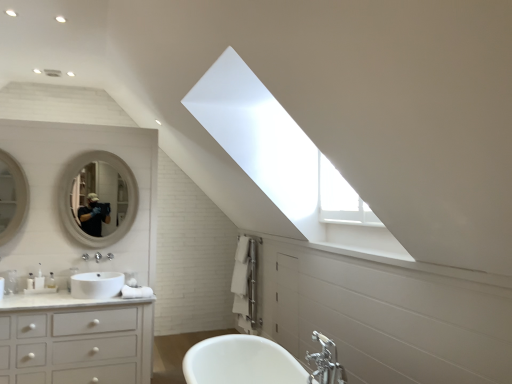
Locate an element on the screen. white glossy mirror at upper left, acting as the 1th mirror starting from the back is located at coordinates (99, 198).

Describe the element at coordinates (12, 197) in the screenshot. This screenshot has height=384, width=512. I see `matte white mirror at left, which is the second mirror from right to left` at that location.

What do you see at coordinates (241, 362) in the screenshot? I see `white glossy bathtub at center` at bounding box center [241, 362].

The height and width of the screenshot is (384, 512). Describe the element at coordinates (75, 340) in the screenshot. I see `white matte cabinet at lower left` at that location.

This screenshot has height=384, width=512. Find the location of `white glossy sink at lower left`. white glossy sink at lower left is located at coordinates (96, 285).

Is white glossy sink at lower left far away from white glossy bathtub at center?

white glossy sink at lower left is far away from white glossy bathtub at center.

Measure the distance between white glossy sink at lower left and white glossy bathtub at center.

A distance of 1.21 meters exists between white glossy sink at lower left and white glossy bathtub at center.

Considering the relative positions of white glossy sink at lower left and white glossy bathtub at center in the image provided, is white glossy sink at lower left to the left or to the right of white glossy bathtub at center?

white glossy sink at lower left is to the left of white glossy bathtub at center.

Based on the photo, is white glossy mirror at upper left, which ranks as the 2th mirror in front-to-back order, not near matte white mirror at left, the 1th mirror positioned from the front?

white glossy mirror at upper left, which ranks as the 2th mirror in front-to-back order, is actually quite close to matte white mirror at left, the 1th mirror positioned from the front.

Can you tell me how much white glossy mirror at upper left, the 1th mirror viewed from the right, and matte white mirror at left, which is the second mirror from right to left, differ in facing direction?

The angular difference between white glossy mirror at upper left, the 1th mirror viewed from the right, and matte white mirror at left, which is the second mirror from right to left, is 0.00102 degrees.

Do you think white glossy mirror at upper left, the 1th mirror viewed from the right, is within matte white mirror at left, which is the second mirror from right to left, or outside of it?

white glossy mirror at upper left, the 1th mirror viewed from the right, is not enclosed by matte white mirror at left, which is the second mirror from right to left.

From a real-world perspective, between white glossy mirror at upper left, the 1th mirror viewed from the right, and matte white mirror at left, acting as the first mirror starting from the left, who is vertically higher?

From a 3D spatial view, matte white mirror at left, acting as the first mirror starting from the left, is above.

From a real-world perspective, is matte white mirror at left, which is the second mirror from right to left, beneath white glossy mirror at upper left, acting as the 1th mirror starting from the back?

No.

Between matte white mirror at left, which is the 2th mirror from back to front, and white glossy mirror at upper left, the 2th mirror when ordered from left to right, which one has smaller size?

With smaller size is matte white mirror at left, which is the 2th mirror from back to front.

Considering the sizes of objects matte white mirror at left, which is the second mirror from right to left, and white glossy mirror at upper left, acting as the 1th mirror starting from the back, in the image provided, who is taller, matte white mirror at left, which is the second mirror from right to left, or white glossy mirror at upper left, acting as the 1th mirror starting from the back,?

white glossy mirror at upper left, acting as the 1th mirror starting from the back, is taller.

Locate an element on the screen. mirror behind the matte white mirror at left, acting as the first mirror starting from the left is located at coordinates (99, 198).

Considering the positions of point (252, 353) and point (119, 185), is point (252, 353) closer or farther from the camera than point (119, 185)?

Point (252, 353).

From the image's perspective, is white glossy bathtub at center below white glossy mirror at upper left, the 1th mirror viewed from the right?

Yes, from the image's perspective, white glossy bathtub at center is beneath white glossy mirror at upper left, the 1th mirror viewed from the right.

Which is more to the left, white glossy bathtub at center or white glossy mirror at upper left, which ranks as the 2th mirror in front-to-back order?

Positioned to the left is white glossy mirror at upper left, which ranks as the 2th mirror in front-to-back order.

Does white matte cabinet at lower left have a lesser width compared to white glossy bathtub at center?

Correct, the width of white matte cabinet at lower left is less than that of white glossy bathtub at center.

How many degrees apart are the facing directions of white matte cabinet at lower left and white glossy bathtub at center?

1.14 degrees.

Which is correct: white matte cabinet at lower left is inside white glossy bathtub at center, or outside of it?

white matte cabinet at lower left exists outside the volume of white glossy bathtub at center.

Which is in front, point (125, 334) or point (221, 346)?

The point (221, 346) is more forward.

You are a GUI agent. You are given a task and a screenshot of the screen. Output one action in this format:
    pyautogui.click(x=<x>, y=<y>)
    Task: Click on the bath on the right of matte white mirror at left, which is the second mirror from right to left
    
    Given the screenshot: What is the action you would take?
    pyautogui.click(x=241, y=362)

How much distance is there between matte white mirror at left, the 1th mirror positioned from the front, and white glossy bathtub at center?

matte white mirror at left, the 1th mirror positioned from the front, and white glossy bathtub at center are 2.15 meters apart.

Considering the relative sizes of matte white mirror at left, which is the second mirror from right to left, and white glossy bathtub at center in the image provided, is matte white mirror at left, which is the second mirror from right to left, thinner than white glossy bathtub at center?

Yes, matte white mirror at left, which is the second mirror from right to left, is thinner than white glossy bathtub at center.

From a real-world perspective, which is physically below, matte white mirror at left, which is the 2th mirror from back to front, or white glossy bathtub at center?

From a 3D spatial view, white glossy bathtub at center is below.

Is white glossy bathtub at center in front of white matte cabinet at lower left?

No, white glossy bathtub at center is behind white matte cabinet at lower left.

In the scene shown: Can you tell me how much white glossy bathtub at center and white matte cabinet at lower left differ in facing direction?

1.14 degrees.

Would you say white glossy bathtub at center is outside white matte cabinet at lower left?

Yes.

Between white glossy bathtub at center and white matte cabinet at lower left, which one appears on the right side from the viewer's perspective?

Positioned to the right is white glossy bathtub at center.

This screenshot has height=384, width=512. Identify the location of bath below the white glossy sink at lower left (from a real-world perspective). (241, 362).

Identify the location of mirror below the matte white mirror at left, which is the 2th mirror from back to front (from the image's perspective). coord(99,198).

Which object lies nearer to the anchor point white glossy mirror at upper left, the 2th mirror when ordered from left to right, white matte cabinet at lower left or white glossy sink at lower left?

white glossy sink at lower left lies closer to white glossy mirror at upper left, the 2th mirror when ordered from left to right, than the other object.

Considering their positions, is white glossy mirror at upper left, acting as the 1th mirror starting from the back, positioned closer to matte white mirror at left, the 1th mirror positioned from the front, than white matte cabinet at lower left?

white glossy mirror at upper left, acting as the 1th mirror starting from the back, is positioned closer to the anchor matte white mirror at left, the 1th mirror positioned from the front.

Which object lies nearer to the anchor point white glossy bathtub at center, chrome metallic faucet at lower center or white glossy mirror at upper left, which ranks as the 2th mirror in front-to-back order?

Based on the image, chrome metallic faucet at lower center appears to be nearer to white glossy bathtub at center.

Based on their spatial positions, is white glossy sink at lower left or white matte cabinet at lower left further from chrome metallic faucet at lower center?

white glossy sink at lower left is positioned further to the anchor chrome metallic faucet at lower center.

Which object lies further to the anchor point white glossy sink at lower left, white glossy mirror at upper left, the 2th mirror when ordered from left to right, or chrome metallic faucet at lower center?

Among the two, chrome metallic faucet at lower center is located further to white glossy sink at lower left.

When comparing their distances from white matte cabinet at lower left, does matte white mirror at left, the 1th mirror positioned from the front, or white glossy sink at lower left seem closer?

The object closer to white matte cabinet at lower left is white glossy sink at lower left.

Estimate the real-world distances between objects in this image. Which object is further from chrome metallic faucet at lower center, white matte cabinet at lower left or white glossy mirror at upper left, the 2th mirror when ordered from left to right?

Among the two, white glossy mirror at upper left, the 2th mirror when ordered from left to right, is located further to chrome metallic faucet at lower center.

From the image, which object appears to be nearer to white matte cabinet at lower left, matte white mirror at left, which is the 2th mirror from back to front, or white glossy bathtub at center?

white glossy bathtub at center is positioned closer to the anchor white matte cabinet at lower left.

You are a GUI agent. You are given a task and a screenshot of the screen. Output one action in this format:
    pyautogui.click(x=<x>, y=<y>)
    Task: Click on the sink between white glossy mirror at upper left, the 1th mirror viewed from the right, and white glossy bathtub at center in the up-down direction
    This screenshot has width=512, height=384.
    Given the screenshot: What is the action you would take?
    pyautogui.click(x=96, y=285)

The image size is (512, 384). Find the location of `sink between matte white mirror at left, which is the second mirror from right to left, and white glossy bathtub at center from top to bottom`. sink between matte white mirror at left, which is the second mirror from right to left, and white glossy bathtub at center from top to bottom is located at coordinates [96, 285].

At what (x,y) coordinates should I click in order to perform the action: click on mirror between matte white mirror at left, the 1th mirror positioned from the front, and white glossy bathtub at center from top to bottom. Please return your answer as a coordinate pair (x, y). The height and width of the screenshot is (384, 512). Looking at the image, I should click on [x=99, y=198].

In order to click on sink between matte white mirror at left, acting as the first mirror starting from the left, and white matte cabinet at lower left in the up-down direction in this screenshot , I will do `click(96, 285)`.